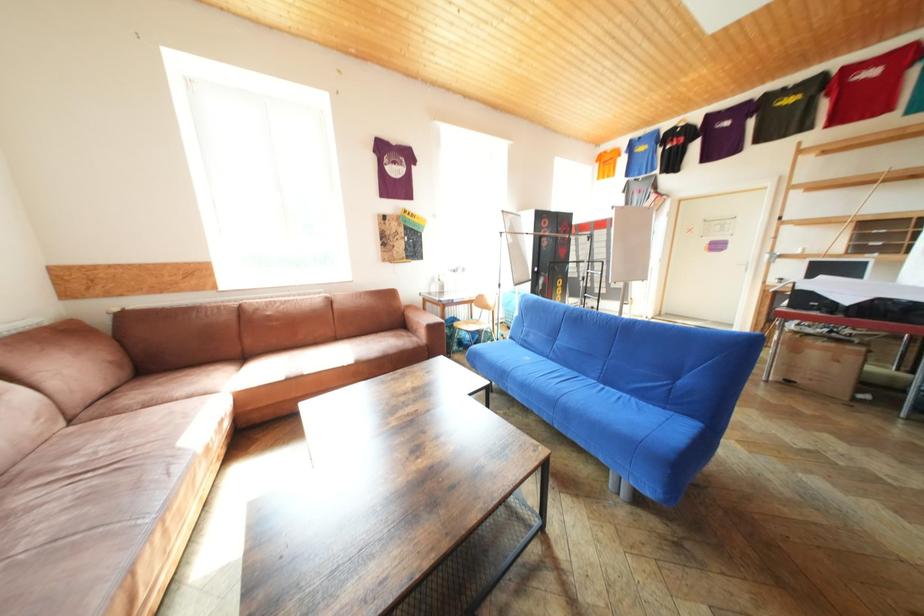
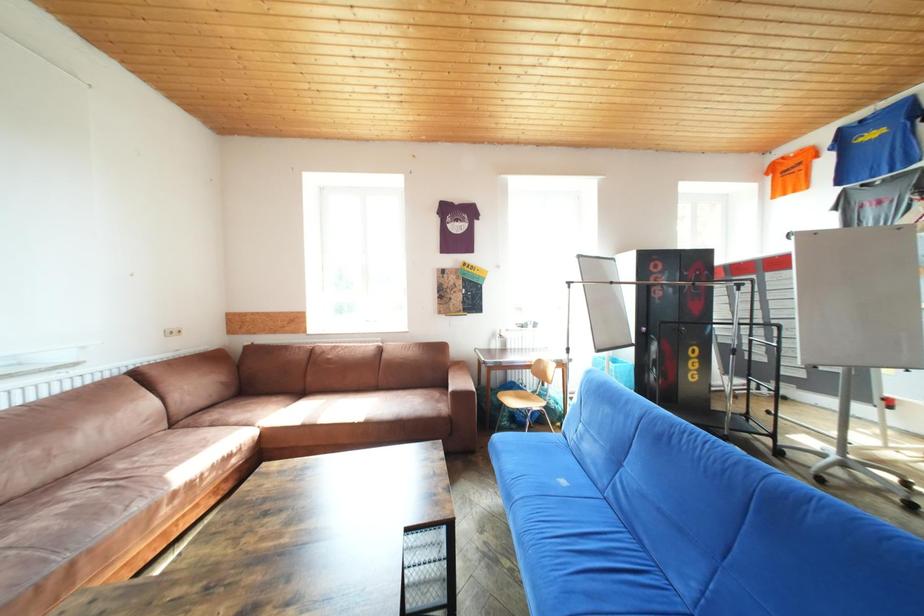
Question: The camera is either moving clockwise (left) or counter-clockwise (right) around the object. The first image is from the beginning of the video and the second image is from the end. Is the camera moving left or right when shooting the video?

Choices:
 (A) Left
 (B) Right

Answer: (B)